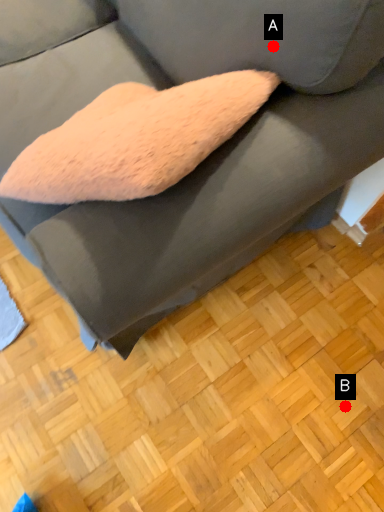
Question: Two points are circled on the image, labeled by A and B beside each circle. Which point is closer to the camera?

Choices:
 (A) A is closer
 (B) B is closer

Answer: (A)